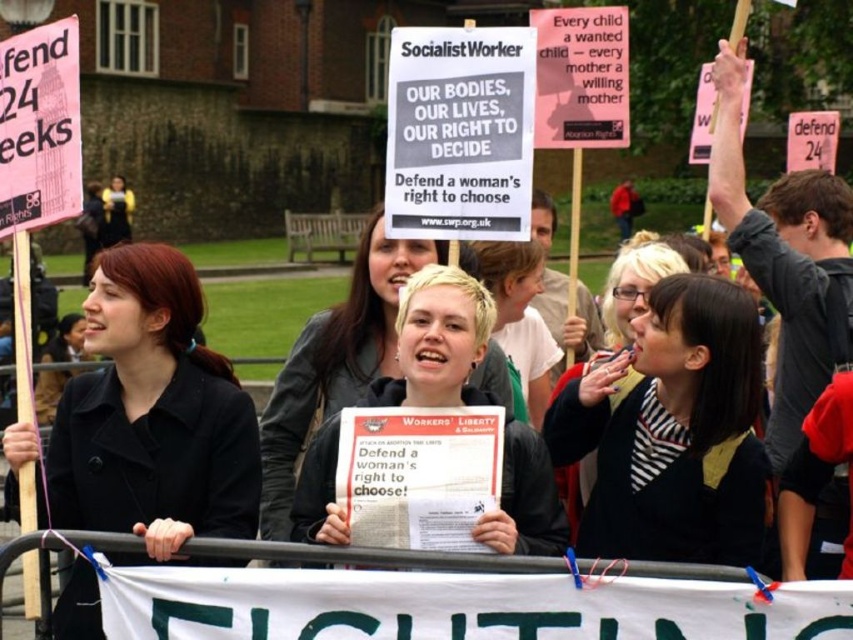
Question: Based on their relative distances, which object is farther from the blonde hair at center?

Choices:
 (A) matte black coat at left
 (B) striped fabric shirt at center

Answer: (B)

Question: Is striped fabric shirt at center bigger than blonde hair at center?

Choices:
 (A) no
 (B) yes

Answer: (A)

Question: Can you confirm if matte black coat at left is positioned above blonde hair at center?

Choices:
 (A) yes
 (B) no

Answer: (A)

Question: Is matte black coat at left positioned behind striped fabric shirt at center?

Choices:
 (A) no
 (B) yes

Answer: (A)

Question: Which is farther from the matte black coat at left?

Choices:
 (A) blonde hair at center
 (B) striped fabric shirt at center

Answer: (B)

Question: Which of the following is the closest to the observer?

Choices:
 (A) (173, 404)
 (B) (718, 291)

Answer: (A)